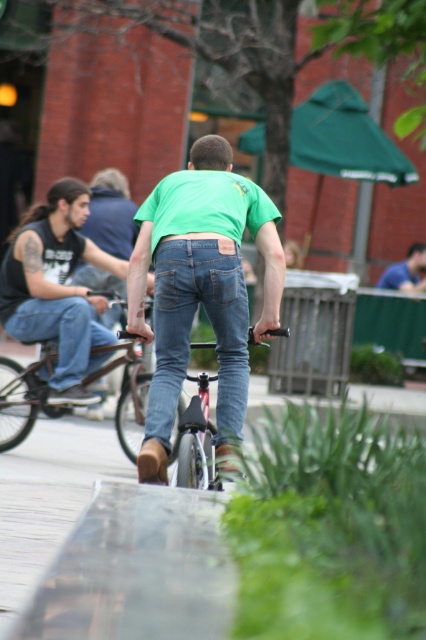
Can you confirm if green matte t-shirt at center is wider than jeans at left?

Incorrect, green matte t-shirt at center's width does not surpass jeans at left's.

Is point (149, 435) more distant than point (86, 312)?

No, (149, 435) is closer to viewer.

Where is `green matte t-shirt at center`? green matte t-shirt at center is located at coordinates click(201, 289).

Is denim jeans at center taller than shiny black bicycle at center?

Indeed, denim jeans at center has a greater height compared to shiny black bicycle at center.

Is denim jeans at center above shiny black bicycle at center?

Yes.

The height and width of the screenshot is (640, 426). Describe the element at coordinates (189, 330) in the screenshot. I see `denim jeans at center` at that location.

Where is `denim jeans at center`? The image size is (426, 640). denim jeans at center is located at coordinates (189, 330).

Can you confirm if shiny black bicycle at center is shorter than blue jeans at center?

No.

Which of these two, shiny black bicycle at center or blue jeans at center, stands taller?

shiny black bicycle at center

Which is in front, point (29, 401) or point (408, 252)?

Point (29, 401) is more forward.

You are a GUI agent. You are given a task and a screenshot of the screen. Output one action in this format:
    pyautogui.click(x=<x>, y=<y>)
    Task: Click on the shiny black bicycle at center
    This screenshot has height=640, width=426.
    Given the screenshot: What is the action you would take?
    pyautogui.click(x=26, y=394)